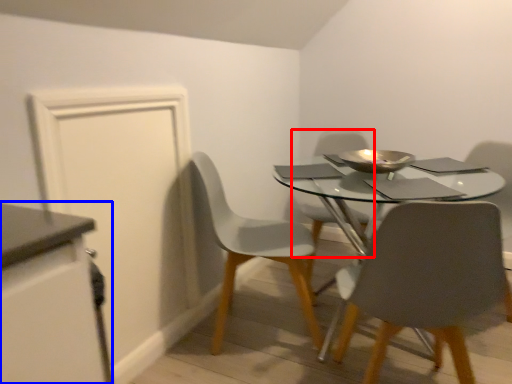
Question: Which of the following is the closest to the observer, chair (highlighted by a red box) or cabinetry (highlighted by a blue box)?

Choices:
 (A) chair
 (B) cabinetry

Answer: (B)